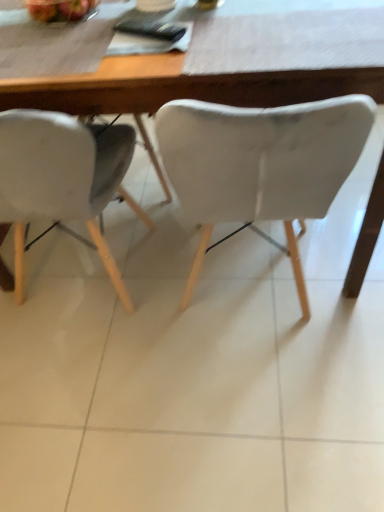
What do you see at coordinates (62, 178) in the screenshot?
I see `white matte chair at left, marked as the 1th chair in a left-to-right arrangement` at bounding box center [62, 178].

Describe the element at coordinates (229, 67) in the screenshot. The width and height of the screenshot is (384, 512). I see `wooden table at center` at that location.

At what (x,y) coordinates should I click in order to perform the action: click on shiny red apple at upper left. Please return your answer as a coordinate pair (x, y). Looking at the image, I should click on click(59, 9).

This screenshot has height=512, width=384. What are the coordinates of `white matte chair at left, marked as the 1th chair in a left-to-right arrangement` in the screenshot? It's located at (62, 178).

Is white matte chair at center, the second chair when ordered from left to right, completely or partially inside shiny red apple at upper left?

No.

From the image's perspective, starting from the shiny red apple at upper left, which chair is the 1st one below? Please provide its 2D coordinates.

[(260, 164)]

Is point (61, 16) positioned in front of point (284, 111)?

No, it is not.

In the scene shown: Relative to white matte chair at center, the second chair when ordered from left to right, is shiny red apple at upper left in front or behind?

In the image, shiny red apple at upper left appears behind white matte chair at center, the second chair when ordered from left to right.

Where is `table below the shiny red apple at upper left (from the image's perspective)`? The image size is (384, 512). table below the shiny red apple at upper left (from the image's perspective) is located at coordinates (229, 67).

Does shiny red apple at upper left have a lesser width compared to wooden table at center?

Yes.

Considering the relative positions of shiny red apple at upper left and wooden table at center in the image provided, is shiny red apple at upper left to the left of wooden table at center from the viewer's perspective?

Correct, you'll find shiny red apple at upper left to the left of wooden table at center.

Is shiny red apple at upper left turned away from wooden table at center?

No, shiny red apple at upper left is not facing the opposite direction of wooden table at center.

Can you confirm if wooden table at center is positioned to the right of white matte chair at left, arranged as the 2th chair when viewed from the right?

Yes, wooden table at center is to the right of white matte chair at left, arranged as the 2th chair when viewed from the right.

Which is closer, (199, 90) or (4, 134)?

Clearly, point (199, 90) is more distant from the camera than point (4, 134).

From the image's perspective, is wooden table at center on white matte chair at left, marked as the 1th chair in a left-to-right arrangement?

Correct, wooden table at center appears higher than white matte chair at left, marked as the 1th chair in a left-to-right arrangement, in the image.

Based on the photo, from a real-world perspective, between wooden table at center and white matte chair at left, arranged as the 2th chair when viewed from the right, who is vertically higher?

white matte chair at left, arranged as the 2th chair when viewed from the right, from a real-world perspective.

Is white matte chair at center, the first chair viewed from the right, to the left of wooden table at center from the viewer's perspective?

No.

How different are the orientations of white matte chair at center, the second chair when ordered from left to right, and wooden table at center in degrees?

The facing directions of white matte chair at center, the second chair when ordered from left to right, and wooden table at center are 90 degrees apart.

Is white matte chair at center, the first chair viewed from the right, aimed at wooden table at center?

Yes, white matte chair at center, the first chair viewed from the right, faces towards wooden table at center.

Is white matte chair at center, the first chair viewed from the right, directly adjacent to wooden table at center?

There is a gap between white matte chair at center, the first chair viewed from the right, and wooden table at center.

From a real-world perspective, is white matte chair at left, arranged as the 2th chair when viewed from the right, positioned above or below shiny red apple at upper left?

In terms of real-world spatial position, white matte chair at left, arranged as the 2th chair when viewed from the right, is below shiny red apple at upper left.

Which is nearer, (67, 218) or (44, 7)?

Positioned in front is point (67, 218).

Is white matte chair at left, marked as the 1th chair in a left-to-right arrangement, to the right of shiny red apple at upper left from the viewer's perspective?

No, white matte chair at left, marked as the 1th chair in a left-to-right arrangement, is not to the right of shiny red apple at upper left.

Between white matte chair at left, arranged as the 2th chair when viewed from the right, and shiny red apple at upper left, which one has larger width?

white matte chair at left, arranged as the 2th chair when viewed from the right, is wider.

Considering the positions of objects white matte chair at left, marked as the 1th chair in a left-to-right arrangement, and wooden table at center in the image provided, who is more to the left, white matte chair at left, marked as the 1th chair in a left-to-right arrangement, or wooden table at center?

white matte chair at left, marked as the 1th chair in a left-to-right arrangement.

From a real-world perspective, which object stands above the other?

white matte chair at left, arranged as the 2th chair when viewed from the right.

In the scene shown: Is white matte chair at left, marked as the 1th chair in a left-to-right arrangement, spatially inside wooden table at center, or outside of it?

white matte chair at left, marked as the 1th chair in a left-to-right arrangement, is located inside wooden table at center.

Find the location of a particular element. This screenshot has height=512, width=384. the 2nd chair located above the wooden table at center (from a real-world perspective) is located at coordinates (260, 164).

Can you confirm if wooden table at center is thinner than white matte chair at center, the second chair when ordered from left to right?

In fact, wooden table at center might be wider than white matte chair at center, the second chair when ordered from left to right.

Considering the relative sizes of wooden table at center and white matte chair at center, the first chair viewed from the right, in the image provided, is wooden table at center taller than white matte chair at center, the first chair viewed from the right,?

No.

Which point is more forward, (21, 83) or (284, 214)?

Point (21, 83)

Find the location of a particular element. This screenshot has height=512, width=384. chair on the right of shiny red apple at upper left is located at coordinates (260, 164).

At what (x,y) coordinates should I click in order to perform the action: click on table in front of the shiny red apple at upper left. Please return your answer as a coordinate pair (x, y). The image size is (384, 512). Looking at the image, I should click on (229, 67).

When comparing their distances from wooden table at center, does white matte chair at center, the second chair when ordered from left to right, or white matte chair at left, marked as the 1th chair in a left-to-right arrangement, seem closer?

white matte chair at center, the second chair when ordered from left to right, is positioned closer to the anchor wooden table at center.

Estimate the real-world distances between objects in this image. Which object is closer to white matte chair at center, the first chair viewed from the right, shiny red apple at upper left or wooden table at center?

wooden table at center.

Which object lies further to the anchor point white matte chair at center, the second chair when ordered from left to right, white matte chair at left, arranged as the 2th chair when viewed from the right, or shiny red apple at upper left?

Based on the image, shiny red apple at upper left appears to be further to white matte chair at center, the second chair when ordered from left to right.

Based on their spatial positions, is white matte chair at center, the second chair when ordered from left to right, or shiny red apple at upper left closer to wooden table at center?

white matte chair at center, the second chair when ordered from left to right, is positioned closer to the anchor wooden table at center.

When comparing their distances from shiny red apple at upper left, does white matte chair at center, the second chair when ordered from left to right, or white matte chair at left, arranged as the 2th chair when viewed from the right, seem closer?

white matte chair at left, arranged as the 2th chair when viewed from the right.

Based on their spatial positions, is shiny red apple at upper left or wooden table at center further from white matte chair at left, arranged as the 2th chair when viewed from the right?

Among the two, shiny red apple at upper left is located further to white matte chair at left, arranged as the 2th chair when viewed from the right.

From the image, which object appears to be nearer to shiny red apple at upper left, white matte chair at left, arranged as the 2th chair when viewed from the right, or white matte chair at center, the second chair when ordered from left to right?

The object closer to shiny red apple at upper left is white matte chair at left, arranged as the 2th chair when viewed from the right.

Considering their positions, is wooden table at center positioned further to shiny red apple at upper left than white matte chair at left, arranged as the 2th chair when viewed from the right?

white matte chair at left, arranged as the 2th chair when viewed from the right, is positioned further to the anchor shiny red apple at upper left.

This screenshot has height=512, width=384. Identify the location of fruit situated between white matte chair at left, arranged as the 2th chair when viewed from the right, and white matte chair at center, the first chair viewed from the right, from left to right. (59, 9).

At what (x,y) coordinates should I click in order to perform the action: click on table that lies between shiny red apple at upper left and white matte chair at left, marked as the 1th chair in a left-to-right arrangement, from top to bottom. Please return your answer as a coordinate pair (x, y). Looking at the image, I should click on (229, 67).

You are a GUI agent. You are given a task and a screenshot of the screen. Output one action in this format:
    pyautogui.click(x=<x>, y=<y>)
    Task: Click on the table between white matte chair at left, arranged as the 2th chair when viewed from the right, and white matte chair at center, the first chair viewed from the right
    The height and width of the screenshot is (512, 384).
    Given the screenshot: What is the action you would take?
    click(229, 67)

Identify the location of table between shiny red apple at upper left and white matte chair at center, the second chair when ordered from left to right, in the horizontal direction. 229,67.